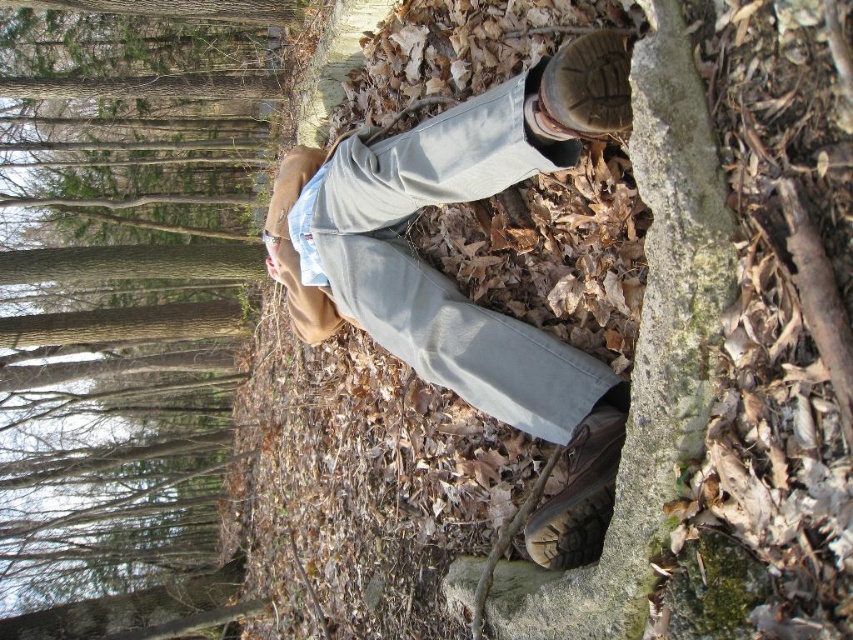
Question: Does brown bark tree at upper left have a larger size compared to light gray denim pants at center?

Choices:
 (A) yes
 (B) no

Answer: (A)

Question: Which of the following is the closest to the observer?

Choices:
 (A) (184, 232)
 (B) (544, 342)

Answer: (B)

Question: Can you confirm if brown bark tree at upper left is thinner than light gray denim pants at center?

Choices:
 (A) yes
 (B) no

Answer: (B)

Question: Which point is closer to the camera?

Choices:
 (A) (125, 340)
 (B) (334, 288)

Answer: (B)

Question: Can you confirm if brown bark tree at upper left is wider than light gray denim pants at center?

Choices:
 (A) no
 (B) yes

Answer: (B)

Question: Among these points, which one is nearest to the camera?

Choices:
 (A) (495, 189)
 (B) (148, 532)

Answer: (A)